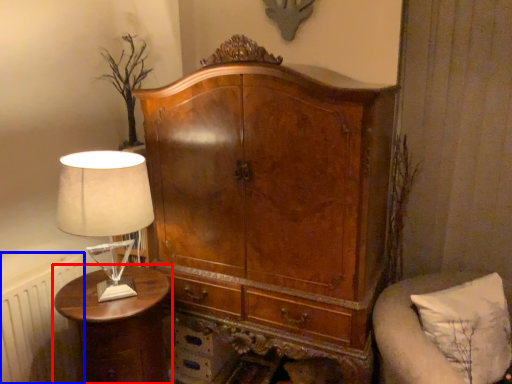
Question: Which of the following is the closest to the observer, nightstand (highlighted by a red box) or radiator (highlighted by a blue box)?

Choices:
 (A) nightstand
 (B) radiator

Answer: (A)